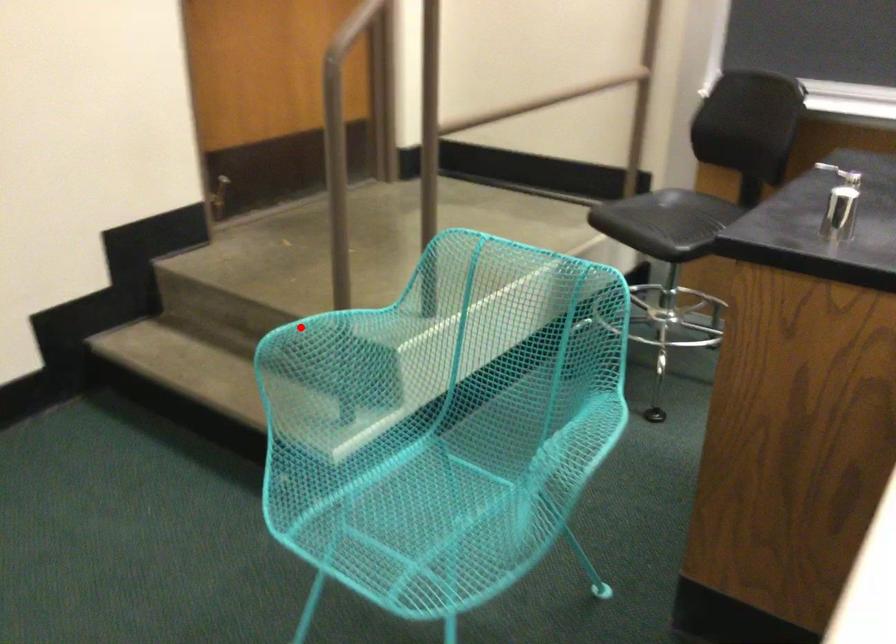
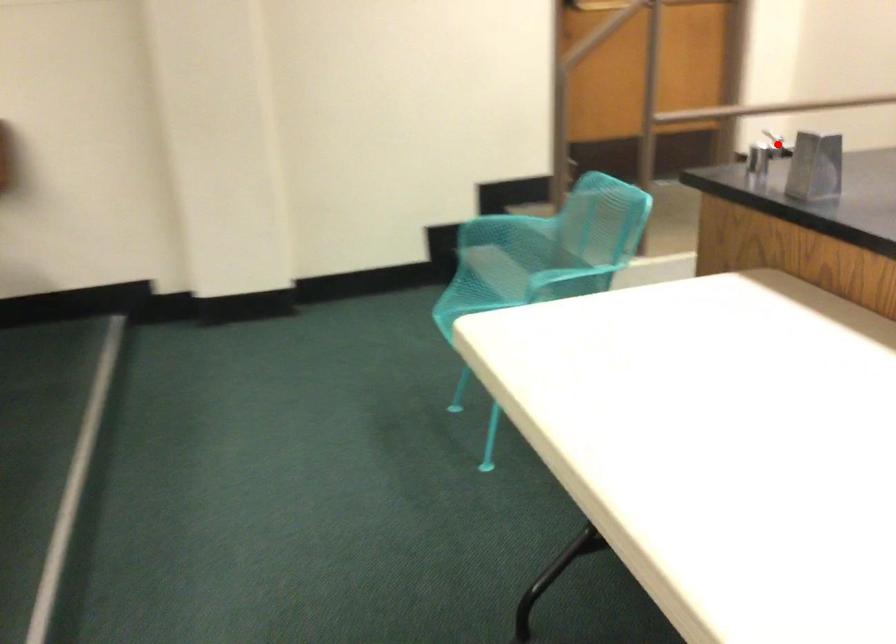
I am providing you with two images of the same scene from different viewpoints. A red point is marked on the first image and another point is marked on the second image. Do the highlighted points in image1 and image2 indicate the same real-world spot?

No